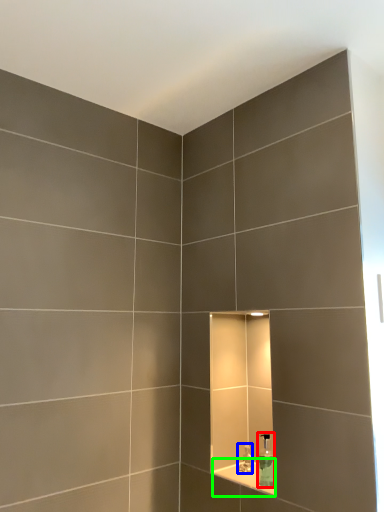
Question: Estimate the real-world distances between objects in this image. Which object is farther from soap dispenser (highlighted by a red box), faucet (highlighted by a blue box) or ledge (highlighted by a green box)?

Choices:
 (A) faucet
 (B) ledge

Answer: (A)